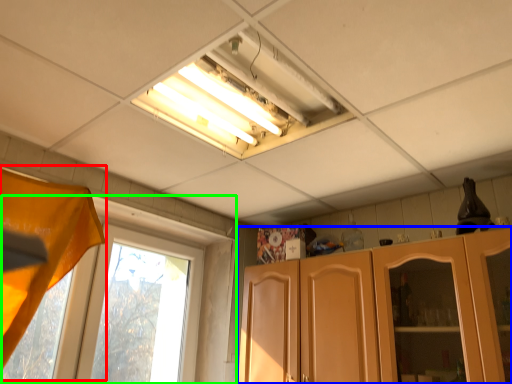
Question: Which object is the closest to the curtain (highlighted by a red box)? Choose among these: cabinetry (highlighted by a blue box) or window (highlighted by a green box).

Choices:
 (A) cabinetry
 (B) window

Answer: (B)